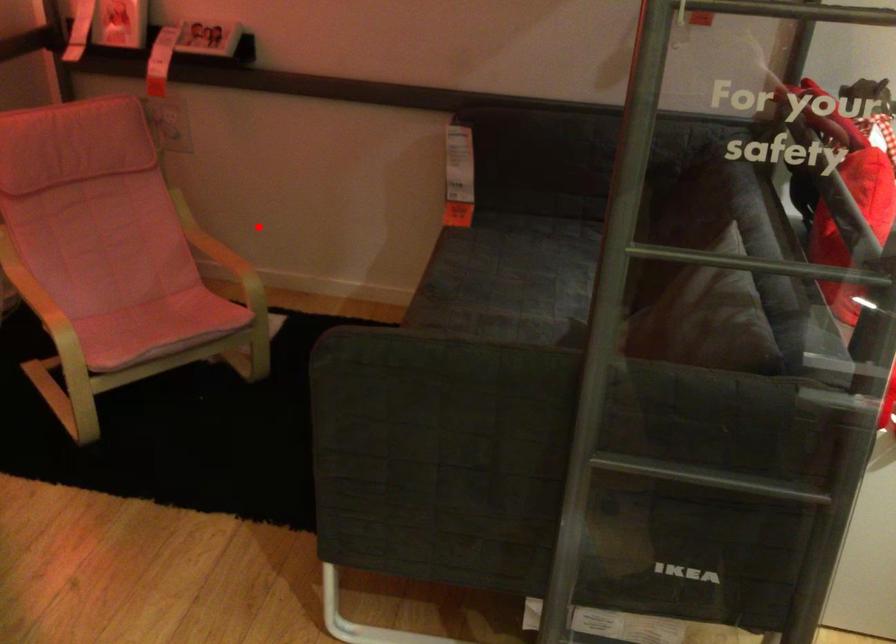
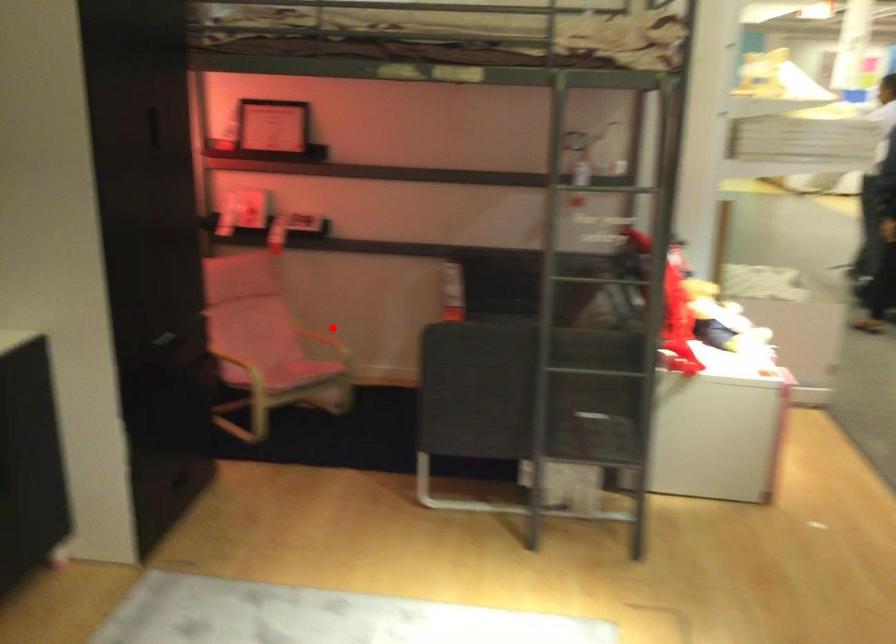
I am providing you with two images of the same scene from different viewpoints. A red point is marked on the first image and another point is marked on the second image. Is the red point in image1 aligned with the point shown in image2?

Yes